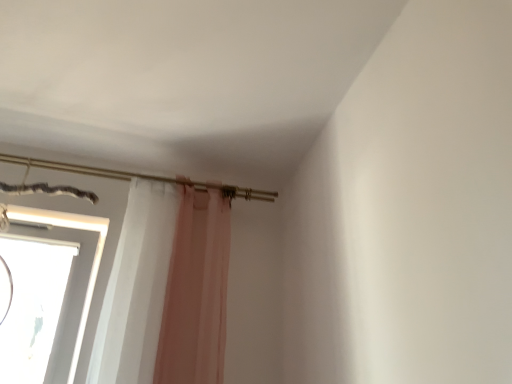
Image resolution: width=512 pixels, height=384 pixels. What do you see at coordinates (93, 260) in the screenshot? I see `white plastic window at left` at bounding box center [93, 260].

In order to face white plastic window at left, should I rotate leftwards or rightwards?

Rotate left and turn 28.583 degrees.

The width and height of the screenshot is (512, 384). What are the coordinates of `white plastic window at left` in the screenshot? It's located at tap(93, 260).

You are a GUI agent. You are given a task and a screenshot of the screen. Output one action in this format:
    pyautogui.click(x=<x>, y=<y>)
    Task: Click on the white plastic window at left
    This screenshot has width=512, height=384.
    Given the screenshot: What is the action you would take?
    pyautogui.click(x=93, y=260)